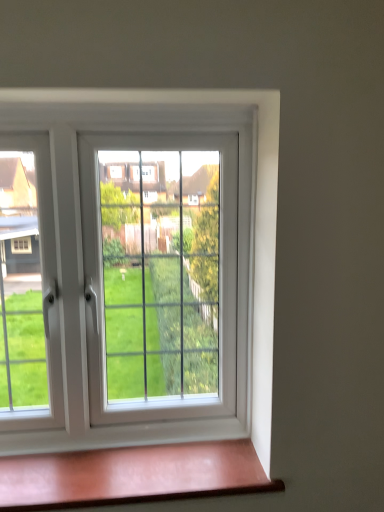
You are a GUI agent. You are given a task and a screenshot of the screen. Output one action in this format:
    pyautogui.click(x=<x>, y=<y>)
    Task: Click on the blank space situated above white plastic window at center (from a real-world perspective)
    
    Given the screenshot: What is the action you would take?
    pyautogui.click(x=101, y=108)